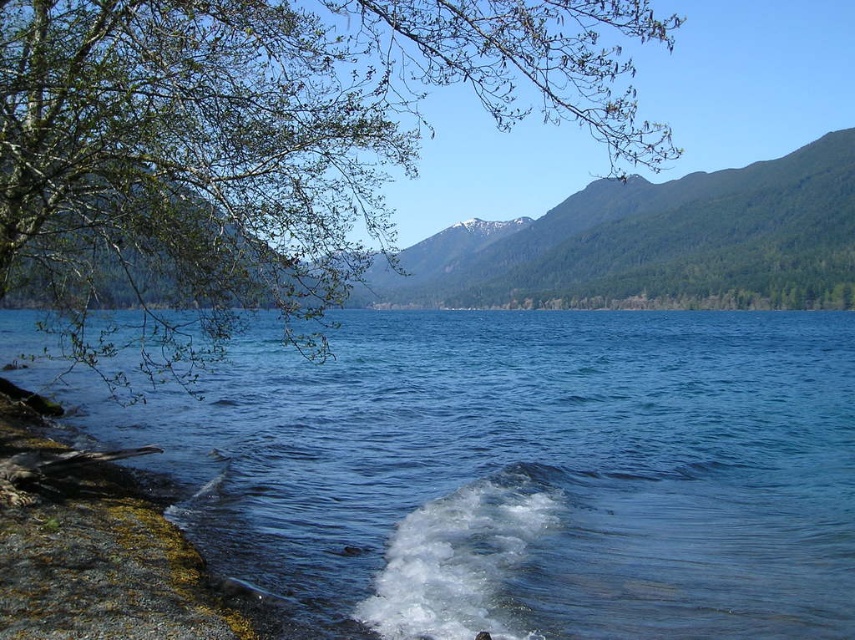
You are a GUI agent. You are given a task and a screenshot of the screen. Output one action in this format:
    pyautogui.click(x=<x>, y=<y>)
    Task: Click on the clear blue water at lower left
    Image resolution: width=855 pixels, height=640 pixels.
    Given the screenshot: What is the action you would take?
    pyautogui.click(x=520, y=472)

Does clear blue water at lower left have a lesser height compared to green forested mountain at upper center?

Correct, clear blue water at lower left is not as tall as green forested mountain at upper center.

The image size is (855, 640). Find the location of `clear blue water at lower left`. clear blue water at lower left is located at coordinates (520, 472).

Is clear blue water at lower left thinner than smooth rock shore at lower left?

Incorrect, clear blue water at lower left's width is not less than smooth rock shore at lower left's.

Can you confirm if clear blue water at lower left is shorter than smooth rock shore at lower left?

No.

Who is more distant from viewer, (x=345, y=348) or (x=60, y=452)?

Positioned behind is point (x=345, y=348).

You are a GUI agent. You are given a task and a screenshot of the screen. Output one action in this format:
    pyautogui.click(x=<x>, y=<y>)
    Task: Click on the clear blue water at lower left
    The height and width of the screenshot is (640, 855).
    Given the screenshot: What is the action you would take?
    pyautogui.click(x=520, y=472)

Between point (830, 248) and point (34, 480), which one is positioned behind?

The point (830, 248) is behind.

Can you confirm if green forested mountain at upper center is smaller than smooth rock shore at lower left?

No, green forested mountain at upper center is not smaller than smooth rock shore at lower left.

Which is in front, point (582, 205) or point (75, 564)?

Positioned in front is point (75, 564).

The image size is (855, 640). In order to click on green forested mountain at upper center in this screenshot , I will do `click(652, 244)`.